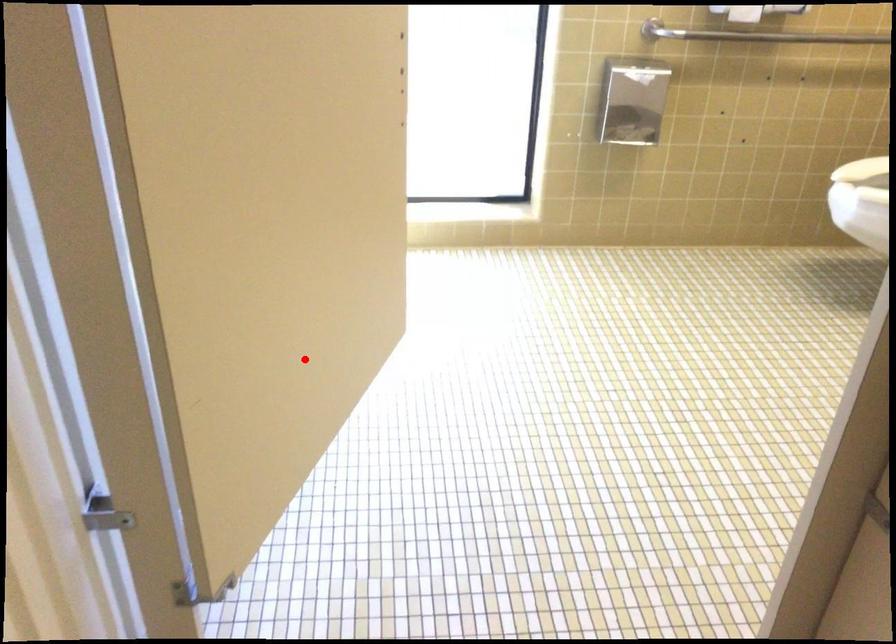
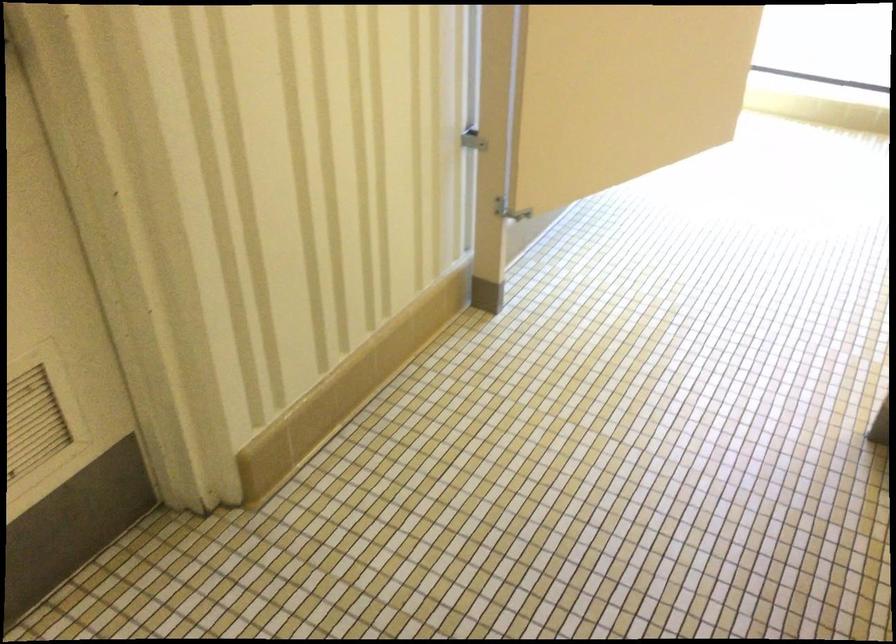
Question: A red point is marked in image1. In image2, is the corresponding 3D point closer to the camera or farther? Reply with the corresponding letter.

Choices:
 (A) The corresponding 3D point is closer.
 (B) The corresponding 3D point is farther.

Answer: (B)